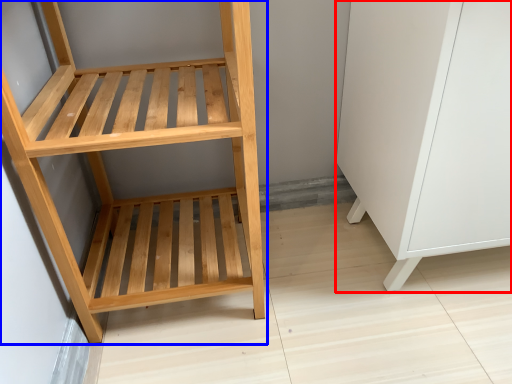
Question: Which object appears closest to the camera in this image, file cabinet (highlighted by a red box) or furniture (highlighted by a blue box)?

Choices:
 (A) file cabinet
 (B) furniture

Answer: (B)